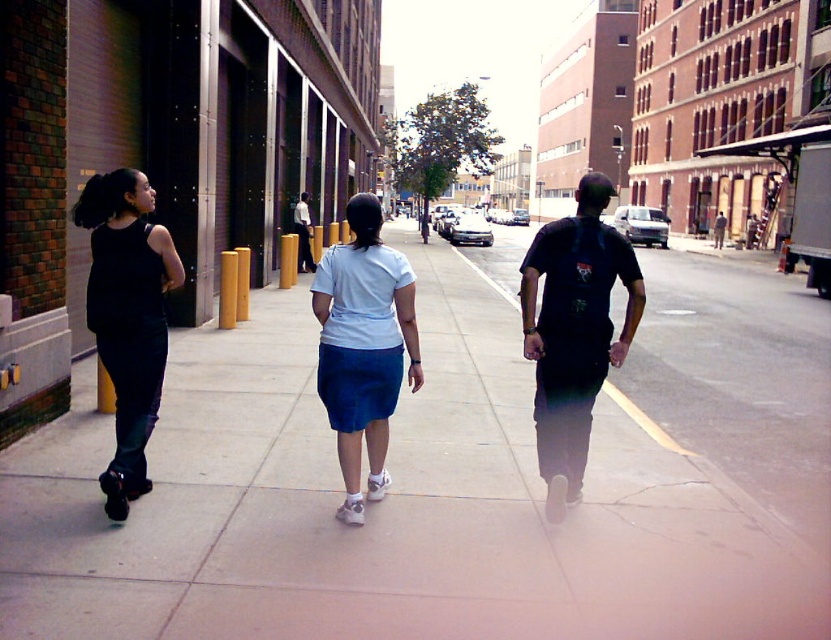
At what (x,y) coordinates should I click in order to perform the action: click on smooth concrete sidewalk at center. Please return your answer as a coordinate pair (x, y). Image resolution: width=831 pixels, height=640 pixels. Looking at the image, I should click on (451, 480).

The width and height of the screenshot is (831, 640). Identify the location of smooth concrete sidewalk at center. (451, 480).

Identify the location of smooth concrete sidewalk at center. (451, 480).

Does dark blue backpack at center appear on the left side of matte black tank top at left?

Incorrect, dark blue backpack at center is not on the left side of matte black tank top at left.

This screenshot has height=640, width=831. Describe the element at coordinates (574, 332) in the screenshot. I see `dark blue backpack at center` at that location.

Identify the location of dark blue backpack at center. The width and height of the screenshot is (831, 640). (574, 332).

Find the location of a particular element. Image resolution: width=831 pixels, height=640 pixels. dark blue backpack at center is located at coordinates (574, 332).

Can you confirm if dark blue backpack at center is shorter than white matte skirt at center?

No.

Image resolution: width=831 pixels, height=640 pixels. What do you see at coordinates (574, 332) in the screenshot?
I see `dark blue backpack at center` at bounding box center [574, 332].

Describe the element at coordinates (574, 332) in the screenshot. This screenshot has height=640, width=831. I see `dark blue backpack at center` at that location.

You are a GUI agent. You are given a task and a screenshot of the screen. Output one action in this format:
    pyautogui.click(x=<x>, y=<y>)
    Task: Click on the dark blue backpack at center
    This screenshot has width=831, height=640.
    Given the screenshot: What is the action you would take?
    pyautogui.click(x=574, y=332)